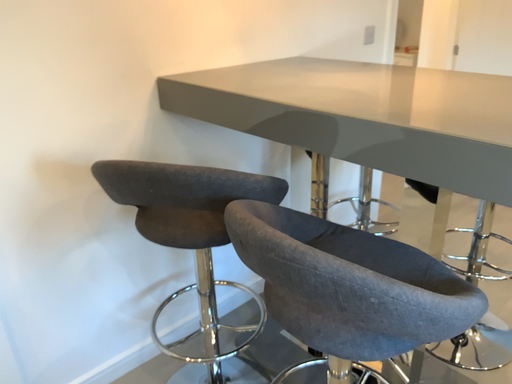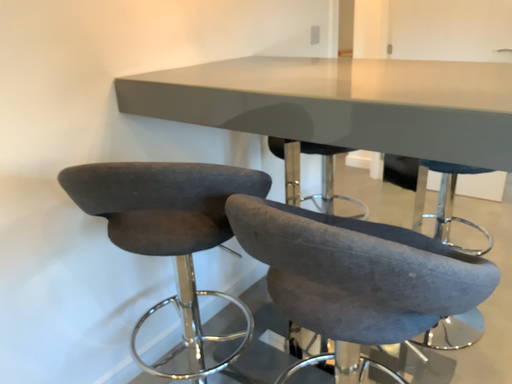
Question: Which way did the camera rotate in the video?

Choices:
 (A) rotated right
 (B) rotated left

Answer: (A)